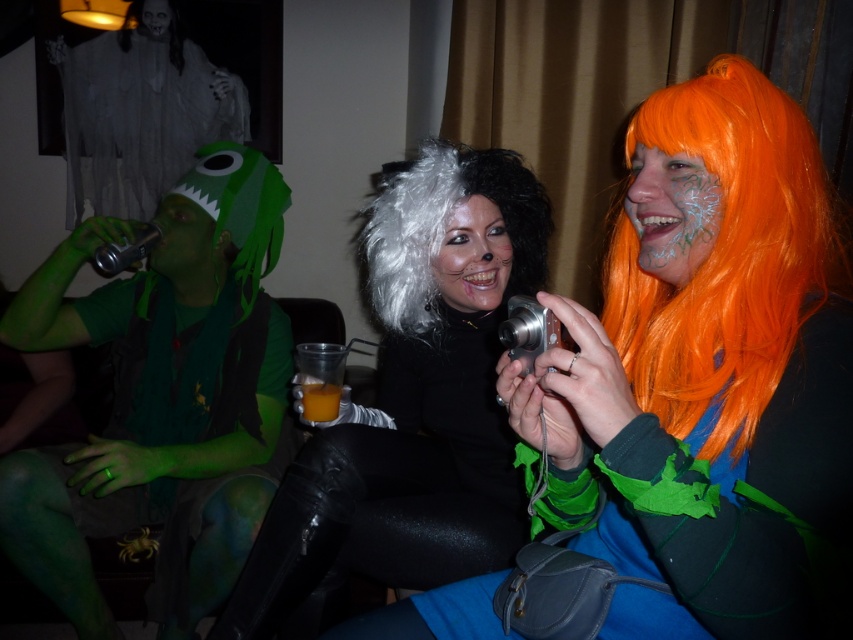
You are holding a camera and want to take a photo of the point at coordinate point (x=701, y=92). If the camera is 71.54 centimeters away from that point, is the point within the camera frame?

The point at coordinate point (x=701, y=92) is 71.54 centimeters away from the camera, so it is within the camera frame.

You are at a Halloween party and notice two wigs placed on a table. The black matte wig at center and the white matte wig at center. Which wig is positioned to the left of the other?

The black matte wig at center is to the left of the white matte wig at center.